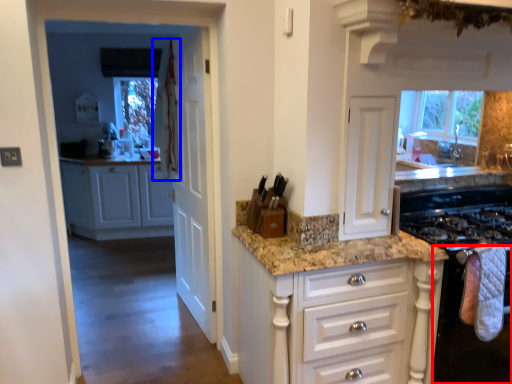
Question: Which object appears farthest to the camera in this image, oven (highlighted by a red box) or curtain (highlighted by a blue box)?

Choices:
 (A) oven
 (B) curtain

Answer: (B)